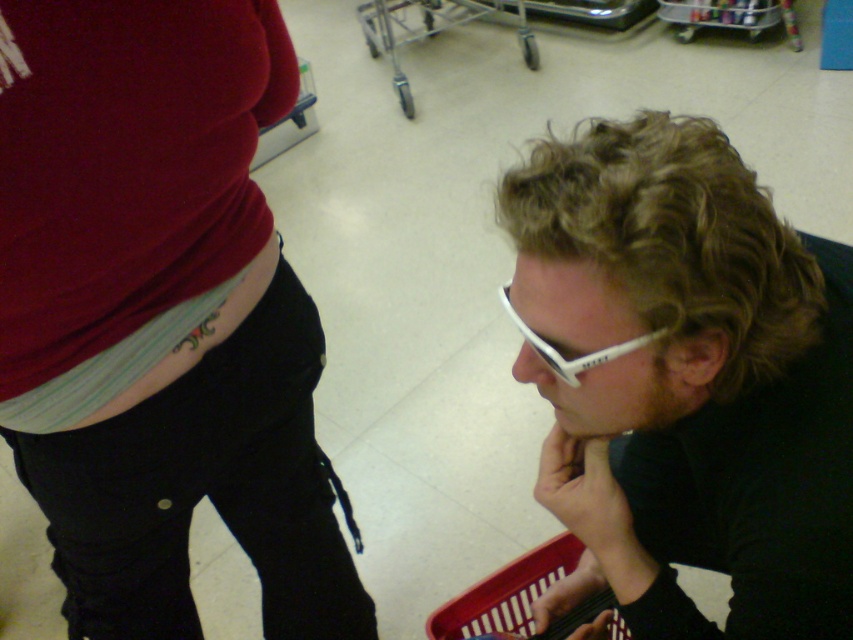
You are standing in a retail store and see two points marked on the floor. The first point is at coordinates point (164, 378) and the second point is at point (410, 4). Which point is closer to you?

Point (164, 378) is closer to the camera than point (410, 4), so the first point is closer to you.

You are standing in a retail store and see the matte black pants at lower left. If you want to pick them up, will you be able to reach them without moving your feet?

The matte black pants at lower left are 24.01 inches away from the viewer, which is within typical reaching distance, so yes, you can reach them without moving your feet.